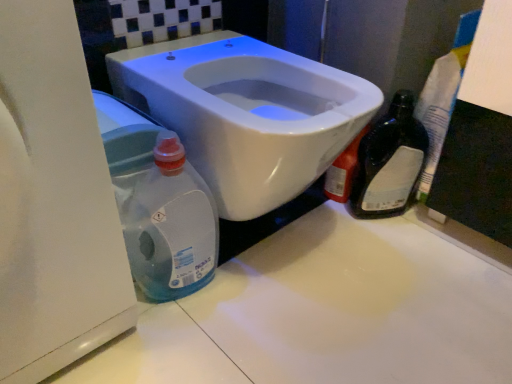
You are a GUI agent. You are given a task and a screenshot of the screen. Output one action in this format:
    pyautogui.click(x=<x>, y=<y>)
    Task: Click on the free space on the front side of white glossy toilet at center
    The height and width of the screenshot is (384, 512).
    Given the screenshot: What is the action you would take?
    272,339